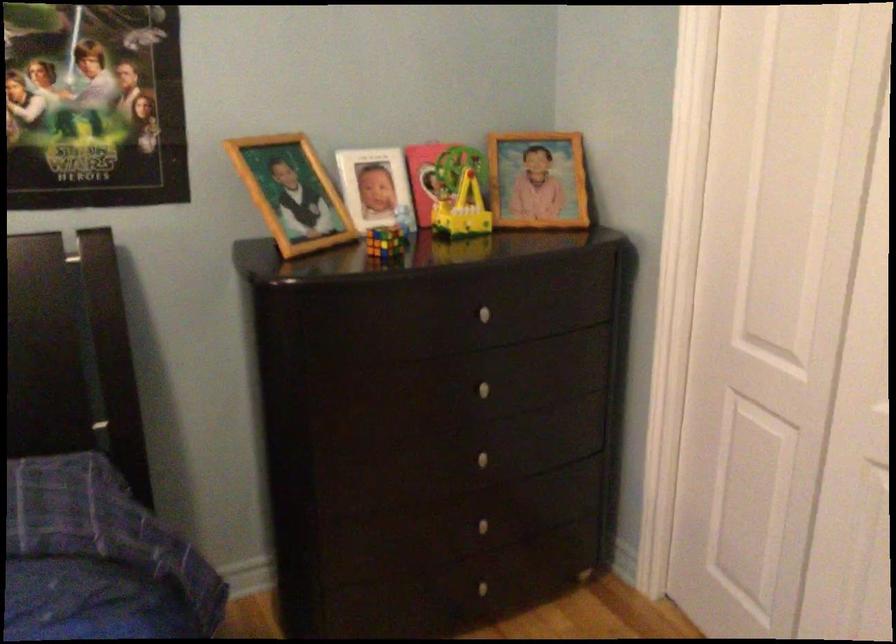
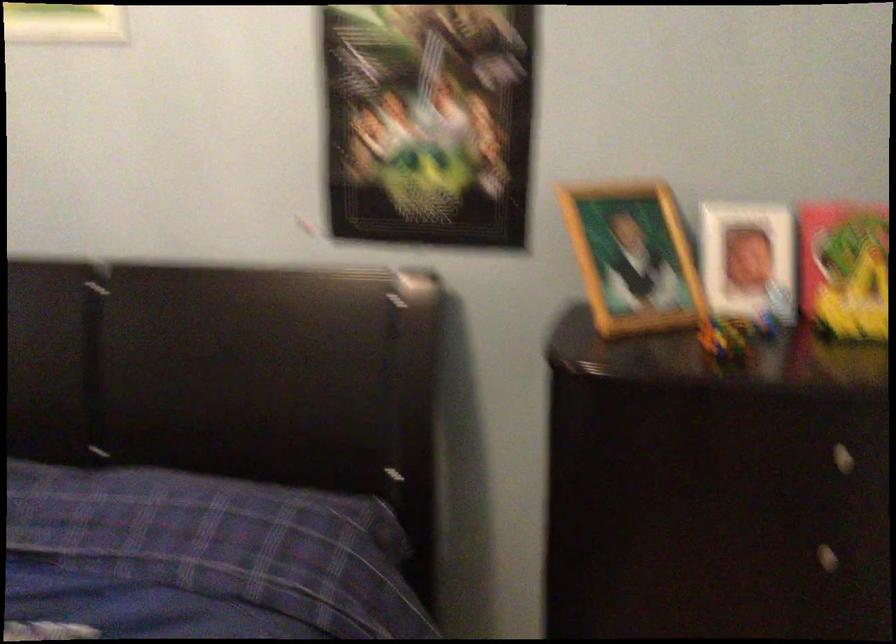
Find the pixel in the second image that matches the point at 476,393 in the first image.

(807, 554)